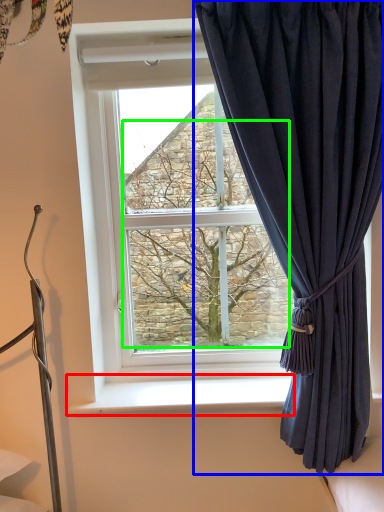
Question: Considering the real-world distances, which object is closest to window sill (highlighted by a red box)? curtain (highlighted by a blue box) or tree (highlighted by a green box).

Choices:
 (A) curtain
 (B) tree

Answer: (B)